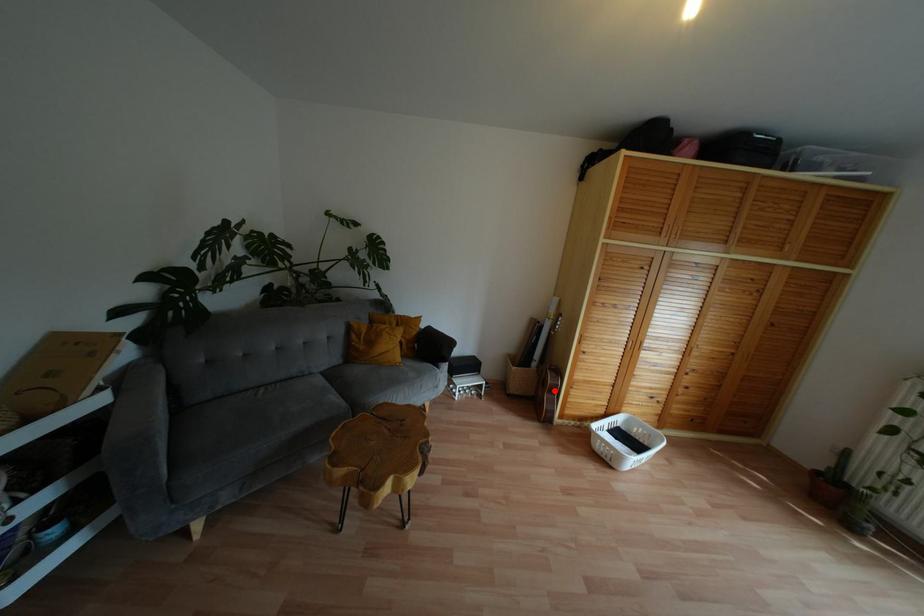
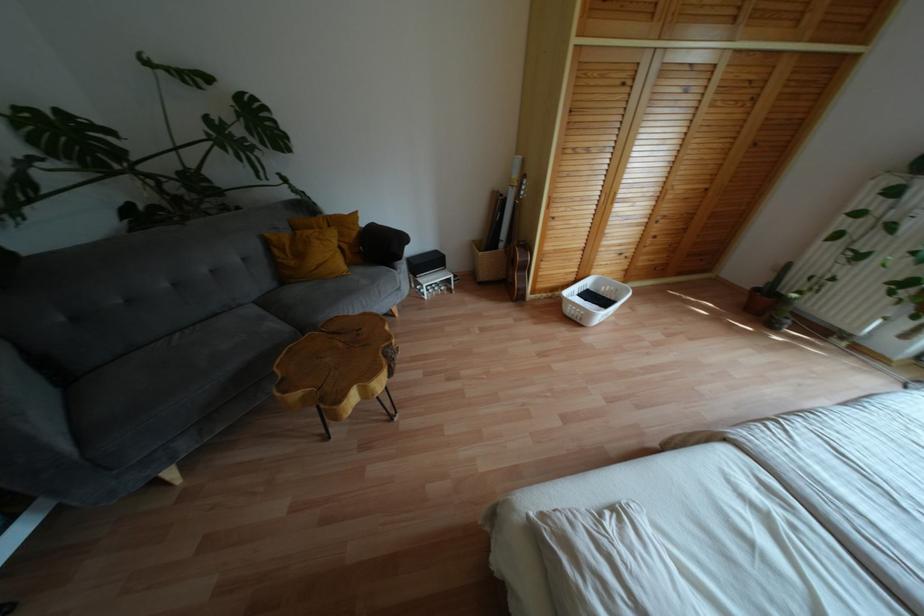
Question: I am providing you with two images of the same scene from different viewpoints. Image1 has a red point marked. In image2, the corresponding 3D location appears at what relative position? Reply with the corresponding letter.

Choices:
 (A) Closer
 (B) Farther

Answer: (B)